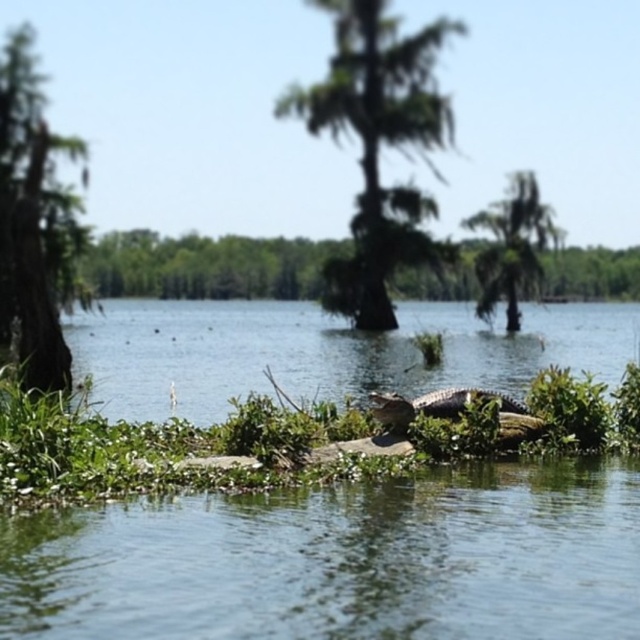
Question: Can you confirm if clear water at center is wider than green leafy tree at upper right?

Choices:
 (A) no
 (B) yes

Answer: (A)

Question: Which of the following is the closest to the observer?

Choices:
 (A) (4, 106)
 (B) (320, 561)
 (C) (417, 406)
 (D) (397, 145)

Answer: (B)

Question: Where is green rough bark tree at left located in relation to green leafy tree at upper right in the image?

Choices:
 (A) below
 (B) above

Answer: (A)

Question: Estimate the real-world distances between objects in this image. Which object is farther from the green leafy tree at upper right?

Choices:
 (A) clear water at center
 (B) green rough bark tree at left
 (C) greenish water at center

Answer: (A)

Question: Which of the following is the closest to the observer?

Choices:
 (A) green leafy tree at center
 (B) clear water at center

Answer: (B)

Question: Can you confirm if clear water at center is positioned above green rough log at center?

Choices:
 (A) yes
 (B) no

Answer: (B)